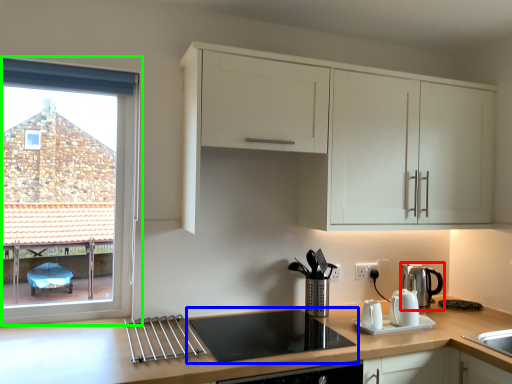
Question: Which is nearer to the kitchen appliance (highlighted by a red box)? gas stove (highlighted by a blue box) or window (highlighted by a green box).

Choices:
 (A) gas stove
 (B) window

Answer: (A)